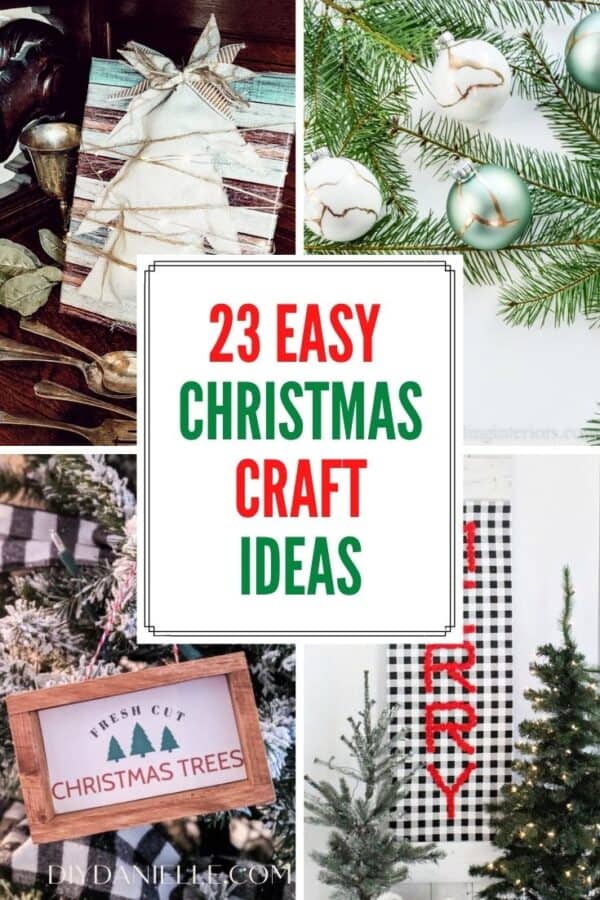
This screenshot has height=900, width=600. Find the location of `spoons`. spoons is located at coordinates (116, 374).